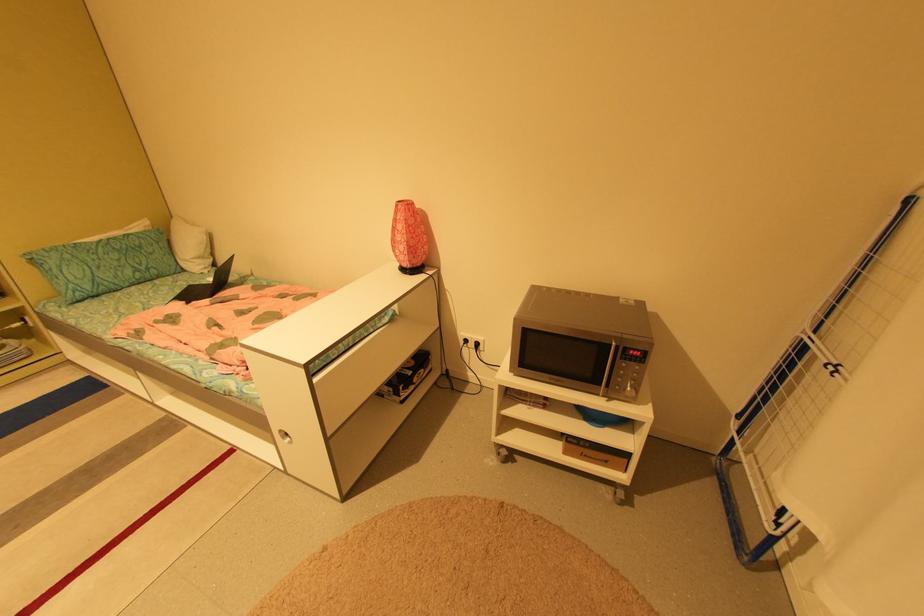
Which object does [207,285] point to?

It refers to a black laptop.